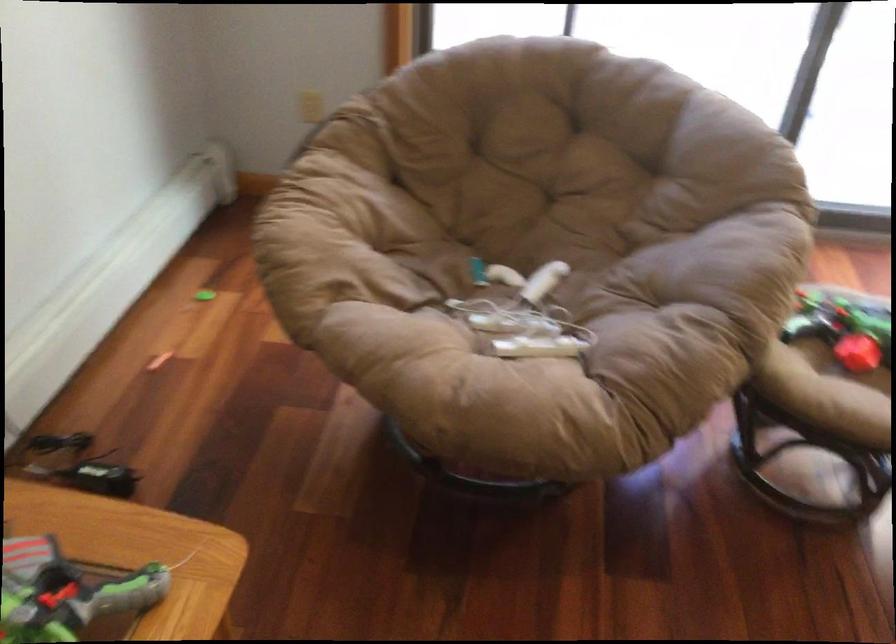
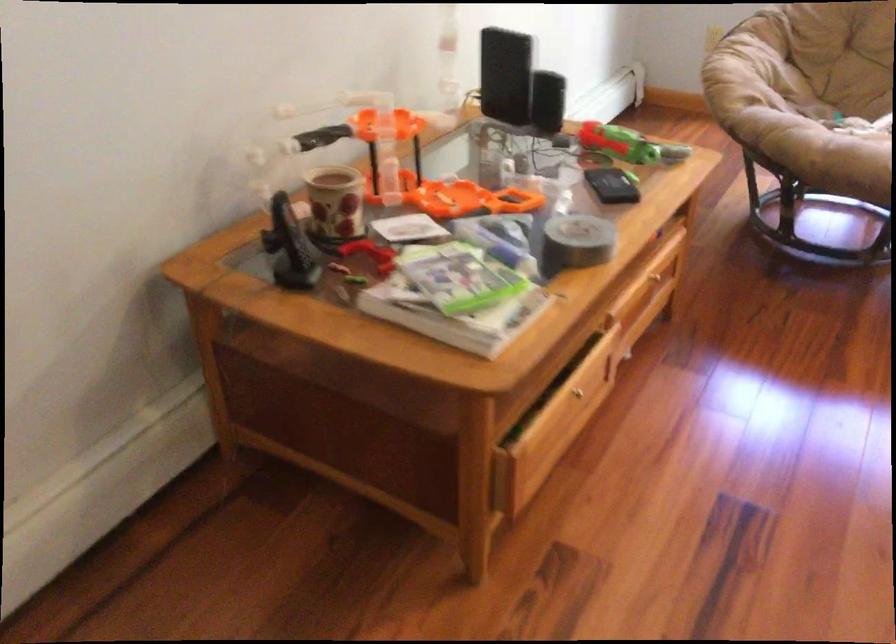
The point at (x=339, y=228) is marked in the first image. Where is the corresponding point in the second image?

(745, 69)